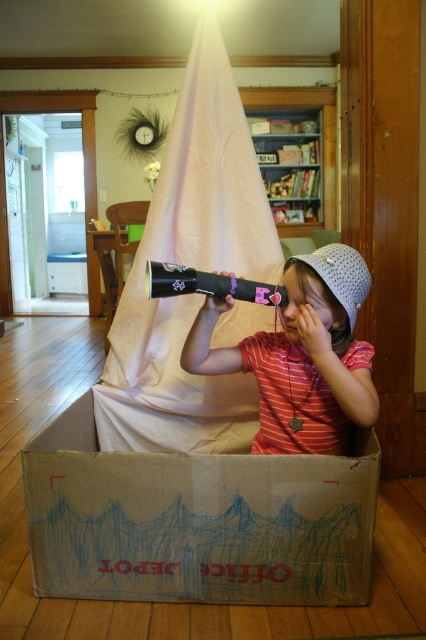
You are a delivery person who just arrived at the house. You need to place a new package on the floor near the brown cardboard box at lower center. Where should you place it?

Place the new package near the brown cardboard box at lower center at point (195,522).

You are a parent trying to take a photo of your child inside the brown cardboard box at lower center and the matte black telescope at center. To ensure both objects are in frame, should you move the box to the right or left?

The brown cardboard box at lower center is positioned on the left side of the matte black telescope at center. To ensure both objects are in frame, you should move the box to the right so it aligns with the telescope.

You are a parent trying to retrieve the matte black telescope at center from your child who is inside the brown cardboard box at lower center. Can you reach the telescope without bending down?

The brown cardboard box at lower center is below the matte black telescope at center, so yes, you can reach the telescope without bending down since it is positioned higher than the box.